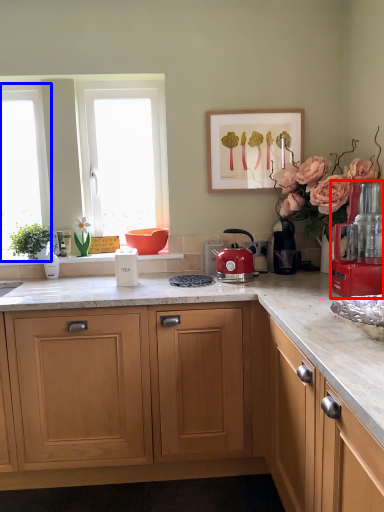
Question: Which of the following is the closest to the observer, kitchen appliance (highlighted by a red box) or window (highlighted by a blue box)?

Choices:
 (A) kitchen appliance
 (B) window

Answer: (A)